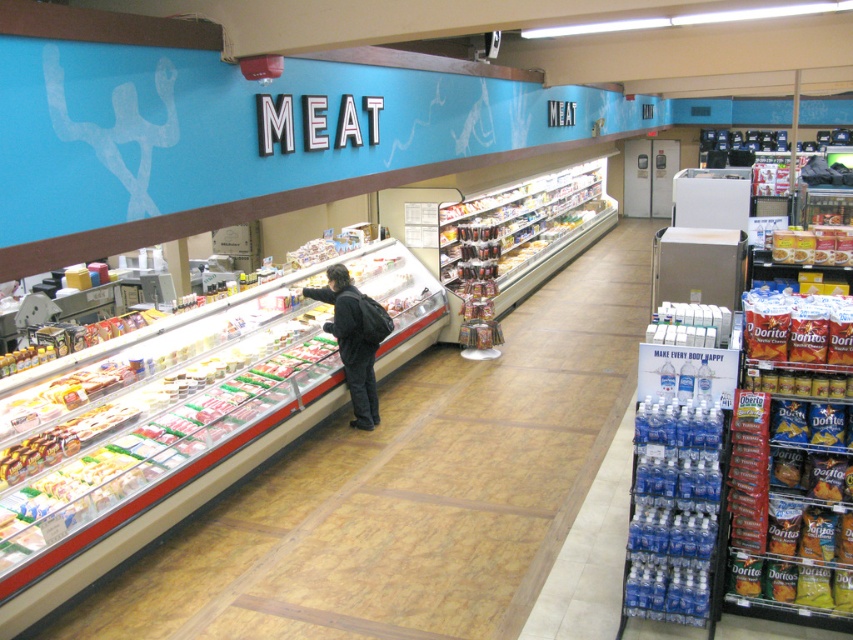
You are a grocery store employee who needs to move the dark gray backpack at center to the storage room. The clear plastic deli case at center is in the way. Can you move the backpack around the deli case without removing it from the center area?

The clear plastic deli case at center might be wider than dark gray backpack at center, so it is uncertain whether there is enough space to maneuver the backpack around it. Check the width difference before attempting to move.

You are a grocery store employee who needs to place a dark gray backpack at center on a shelf above the clear plastic deli case at center. Can you do this without moving the deli case?

The clear plastic deli case at center is taller than the dark gray backpack at center. Since the deli case is taller, placing the backpack on a shelf above it would require the shelf to be positioned higher than the deli case. However, the description does not mention the height of the shelf, so it is uncertain if there is enough space above the deli case to place the backpack without moving it. Therefore, it might not be possible without additional information about the shelf height.